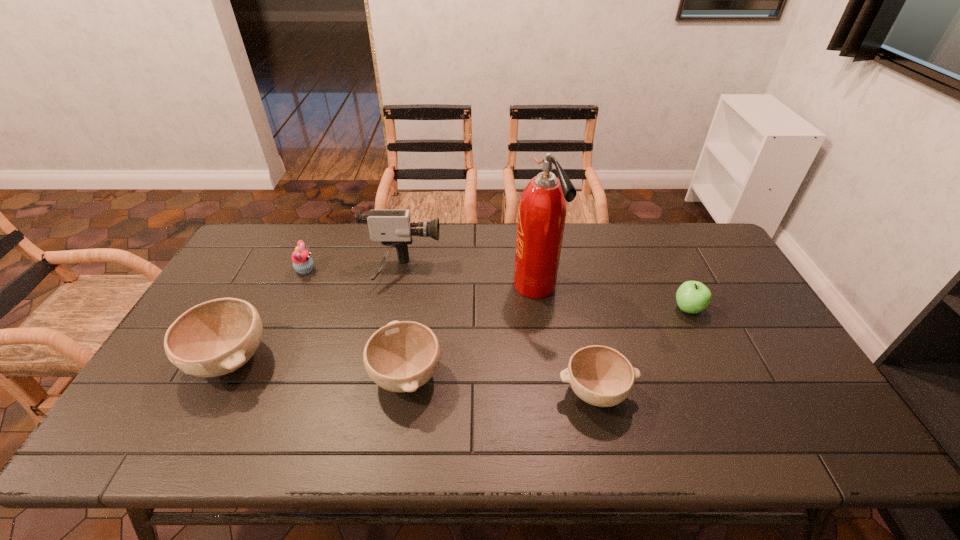
Find the location of a particular element. vacant space that is in between the cupcake and the leftmost bowl is located at coordinates (268, 315).

I want to click on empty space between the second bowl from left to right and the tallest object, so click(470, 331).

I want to click on free space that is in between the camcorder and the fire extinguisher, so click(468, 279).

Select which object is the second closest to the shortest bowl. Please provide its 2D coordinates. Your answer should be formatted as a tuple, i.e. [(x, y)], where the tuple contains the x and y coordinates of a point satisfying the conditions above.

[(692, 297)]

The height and width of the screenshot is (540, 960). Find the location of `object that is the fourth closest to the tallest object`. object that is the fourth closest to the tallest object is located at coordinates [x=692, y=297].

This screenshot has width=960, height=540. I want to click on bowl object that ranks as the second closest to the rightmost object, so click(x=402, y=356).

In order to click on bowl that stands as the closest to the second bowl from left to right in this screenshot , I will do `click(214, 338)`.

Locate an element on the screen. vacant area that satisfies the following two spatial constraints: 1. on the back side of the shortest bowl; 2. on the recording direction of the camcorder is located at coordinates (568, 272).

Find the location of `vacant space that satisfies the following two spatial constraints: 1. on the back side of the apple; 2. on the recording direction of the second tallest object`. vacant space that satisfies the following two spatial constraints: 1. on the back side of the apple; 2. on the recording direction of the second tallest object is located at coordinates pyautogui.click(x=670, y=272).

In order to click on vacant space that satisfies the following two spatial constraints: 1. on the face of the apple; 2. on the right side of the cupcake in this screenshot , I will do `click(288, 309)`.